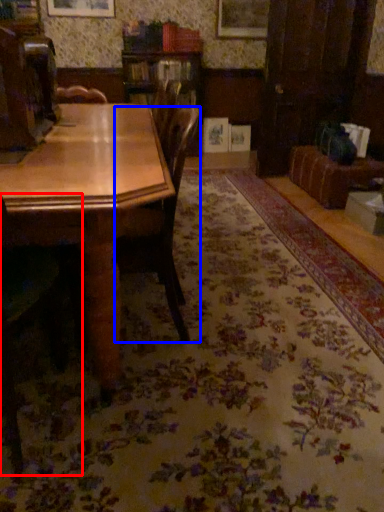
Question: Which object is further to the camera taking this photo, chair (highlighted by a red box) or chair (highlighted by a blue box)?

Choices:
 (A) chair
 (B) chair

Answer: (B)